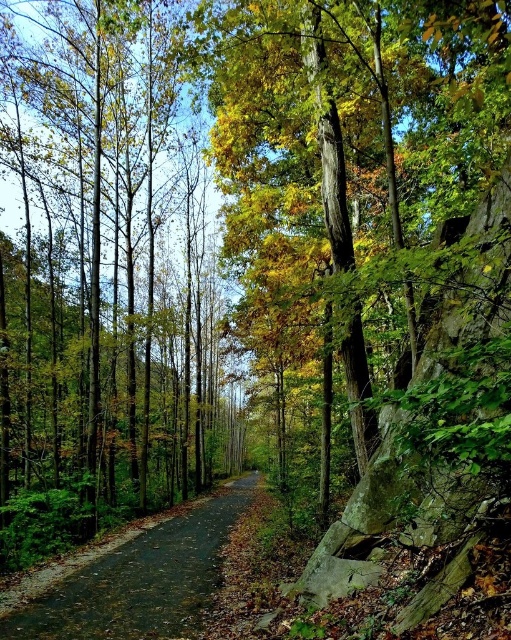
You are a hiker standing at the start of the path in the forest scene. You notice the brown smooth tree at center and the dark asphalt road at center. Which object is closer to you as you begin your hike?

The brown smooth tree at center is positioned over the dark asphalt road at center, meaning it is closer to you as you start your hike.

You are standing on the path in the forest and see two points marked in the image. Which point is closer to you, point (42, 388) or point (190, 556)?

Point (42, 388) is closer to you because it is further to the viewer than point (190, 556).